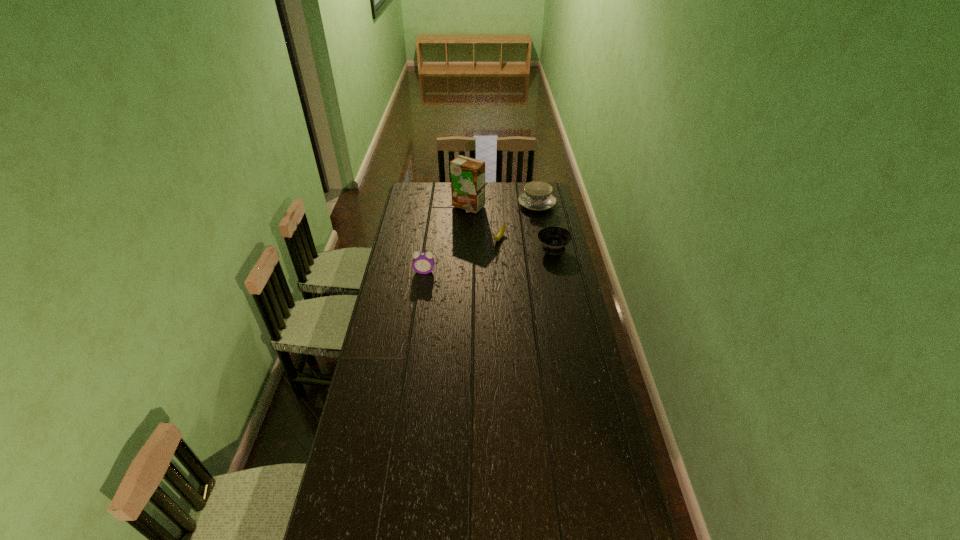
Find the location of a particular element. This screenshot has height=540, width=960. object present at the left edge is located at coordinates (423, 262).

Locate an element on the screen. Image resolution: width=960 pixels, height=540 pixels. bowl that is at the right edge is located at coordinates (554, 239).

You are a GUI agent. You are given a task and a screenshot of the screen. Output one action in this format:
    pyautogui.click(x=<x>, y=<y>)
    Task: Click on the chinaware that is at the right edge
    Image resolution: width=960 pixels, height=540 pixels.
    Given the screenshot: What is the action you would take?
    pyautogui.click(x=537, y=196)

You are a GUI agent. You are given a task and a screenshot of the screen. Output one action in this format:
    pyautogui.click(x=<x>, y=<y>)
    Task: Click on the object located in the far right corner section of the desktop
    The image size is (960, 540).
    Given the screenshot: What is the action you would take?
    pyautogui.click(x=537, y=196)

This screenshot has width=960, height=540. In order to click on vacant space at the far edge of the desktop in this screenshot , I will do `click(509, 185)`.

Where is `free space at the near edge of the desktop`? free space at the near edge of the desktop is located at coordinates (538, 512).

Where is `blank space at the left edge of the desktop`? blank space at the left edge of the desktop is located at coordinates (424, 207).

I want to click on vacant space at the right edge of the desktop, so click(x=570, y=304).

You are a GUI agent. You are given a task and a screenshot of the screen. Output one action in this format:
    pyautogui.click(x=<x>, y=<y>)
    Task: Click on the vacant space at the far left corner of the desktop
    The image size is (960, 540).
    Given the screenshot: What is the action you would take?
    pyautogui.click(x=415, y=191)

The height and width of the screenshot is (540, 960). Identify the location of vacant space at the near left corner of the desktop. (348, 517).